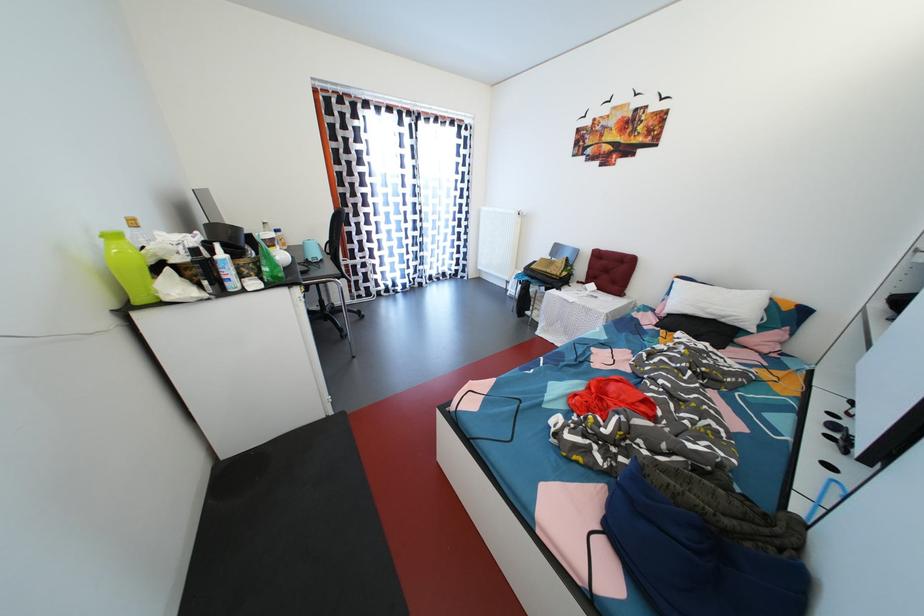
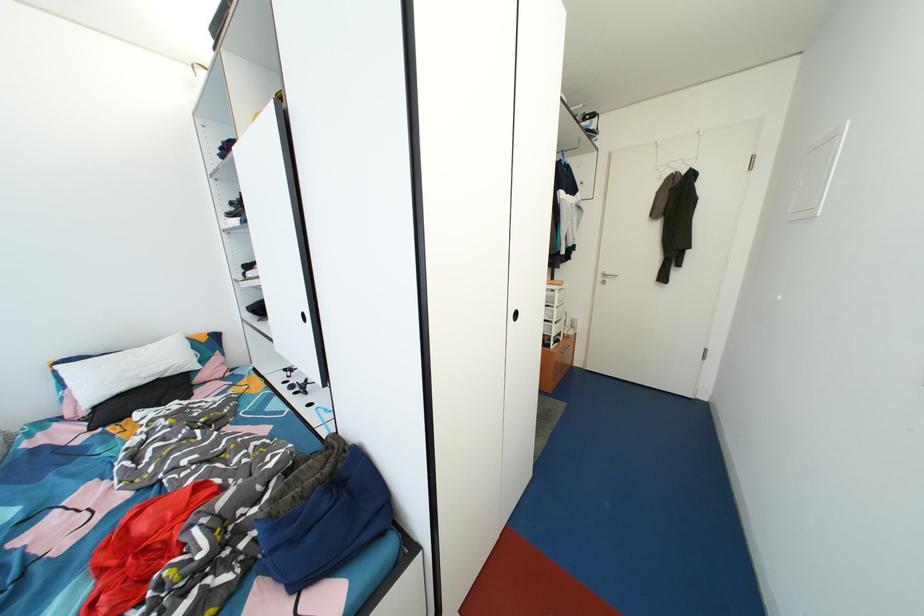
The images are taken continuously from a first-person perspective. In which direction is your viewpoint rotating?

The camera rotated toward right-down.